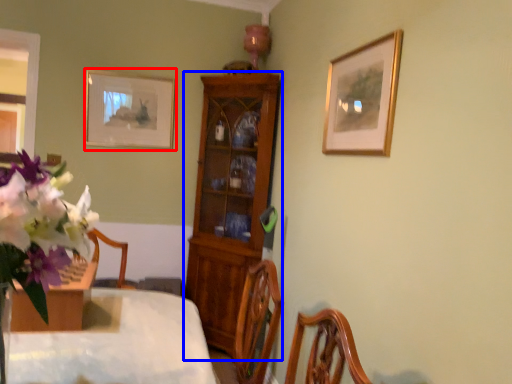
Question: Which point is closer to the camera, picture frame (highlighted by a red box) or cabinetry (highlighted by a blue box)?

Choices:
 (A) picture frame
 (B) cabinetry

Answer: (B)